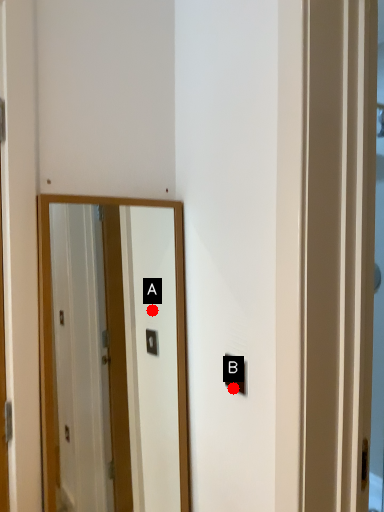
Question: Two points are circled on the image, labeled by A and B beside each circle. Among these points, which one is nearest to the camera?

Choices:
 (A) A is closer
 (B) B is closer

Answer: (B)